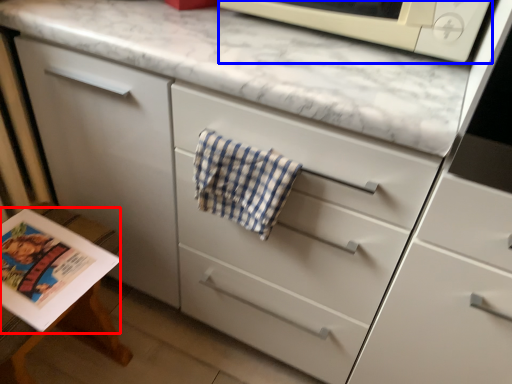
Question: Which object is further to the camera taking this photo, magazine (highlighted by a red box) or microwave oven (highlighted by a blue box)?

Choices:
 (A) magazine
 (B) microwave oven

Answer: (A)